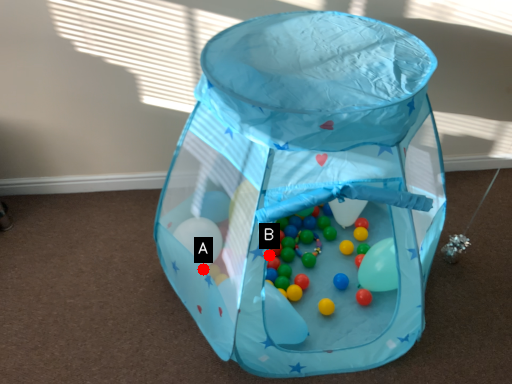
Question: Two points are circled on the image, labeled by A and B beside each circle. Which point is further to the camera?

Choices:
 (A) A is further
 (B) B is further

Answer: (B)